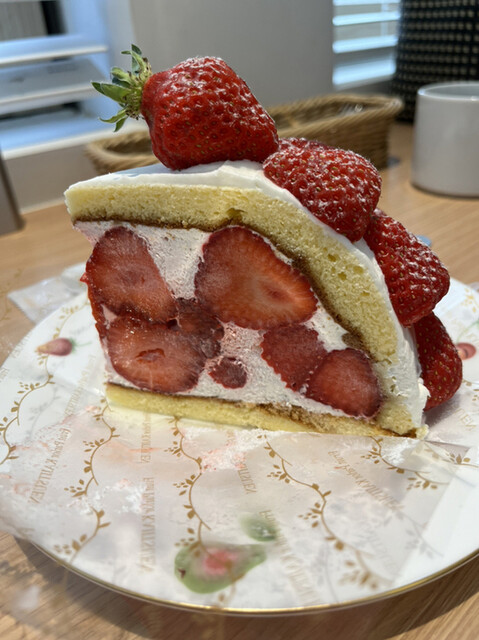
Where is `plate with leaf, vine designs`? Image resolution: width=479 pixels, height=640 pixels. plate with leaf, vine designs is located at coordinates (454, 539).